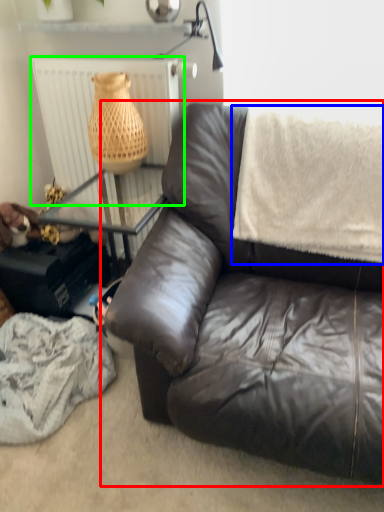
Question: Based on their relative distances, which object is farther from studio couch (highlighted by a red box)? Choose from blanket (highlighted by a blue box) and radiator (highlighted by a green box).

Choices:
 (A) blanket
 (B) radiator

Answer: (B)